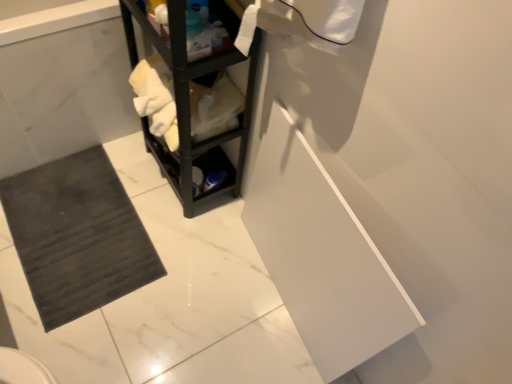
Where is `unoccupied region to the right of dark gray rubber bath mat at lower left`? Image resolution: width=512 pixels, height=384 pixels. unoccupied region to the right of dark gray rubber bath mat at lower left is located at coordinates (145, 188).